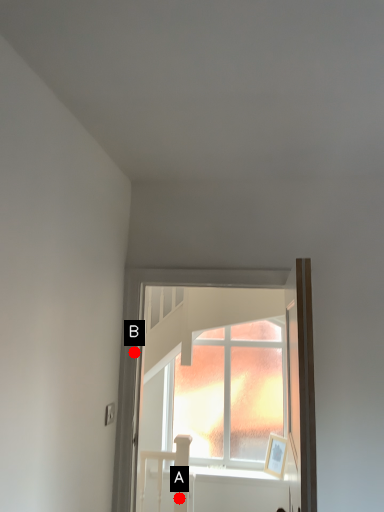
Question: Two points are circled on the image, labeled by A and B beside each circle. Which of the following is the farthest from the observer?

Choices:
 (A) A is further
 (B) B is further

Answer: (A)